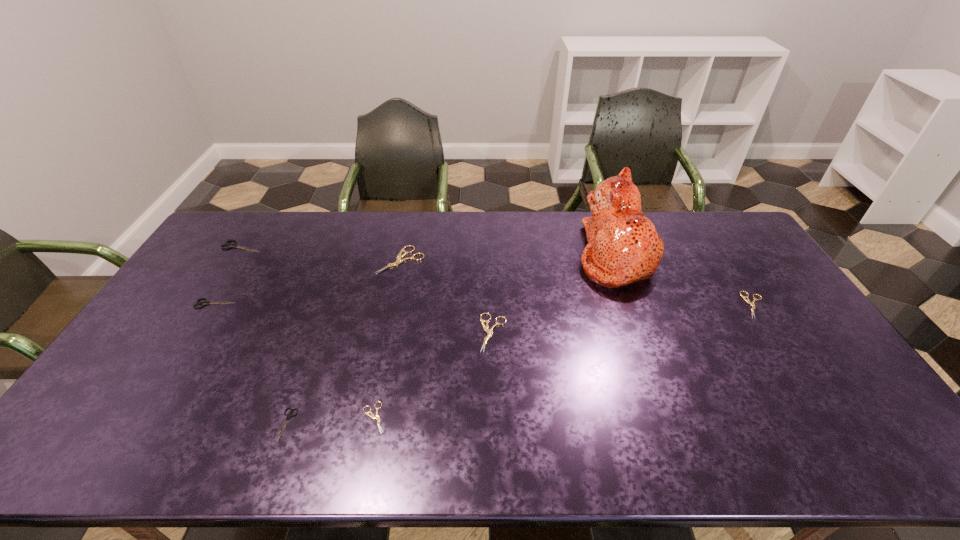
Locate an element on the screen. Image resolution: width=960 pixels, height=540 pixels. vacant area between the rightmost black shears and the second farthest black shears is located at coordinates (252, 364).

Locate an element on the screen. free area in between the second beige shears from right to left and the rightmost object is located at coordinates (624, 319).

Locate which object ranks in proximity to the second biggest black shears. Please provide its 2D coordinates. Your answer should be formatted as a tuple, i.e. [(x, y)], where the tuple contains the x and y coordinates of a point satisfying the conditions above.

[(231, 245)]

Locate which object ranks second in proximity to the rightmost shears. Please provide its 2D coordinates. Your answer should be formatted as a tuple, i.e. [(x, y)], where the tuple contains the x and y coordinates of a point satisfying the conditions above.

[(489, 331)]

Choose which shears is the fourth nearest neighbor to the biggest beige shears. Please provide its 2D coordinates. Your answer should be formatted as a tuple, i.e. [(x, y)], where the tuple contains the x and y coordinates of a point satisfying the conditions above.

[(372, 416)]

Identify which shears is located as the third nearest to the third beige shears from left to right. Please provide its 2D coordinates. Your answer should be formatted as a tuple, i.e. [(x, y)], where the tuple contains the x and y coordinates of a point satisfying the conditions above.

[(288, 416)]

Locate an element on the screen. The height and width of the screenshot is (540, 960). black shears that stands as the third closest to the smallest beige shears is located at coordinates (231, 245).

Point out which black shears is positioned as the nearest to the smallest black shears. Please provide its 2D coordinates. Your answer should be formatted as a tuple, i.e. [(x, y)], where the tuple contains the x and y coordinates of a point satisfying the conditions above.

[(205, 302)]

Locate an element on the screen. The width and height of the screenshot is (960, 540). beige shears identified as the closest to the nearest beige shears is located at coordinates (489, 331).

Identify which beige shears is the second closest to the sixth object from right to left. Please provide its 2D coordinates. Your answer should be formatted as a tuple, i.e. [(x, y)], where the tuple contains the x and y coordinates of a point satisfying the conditions above.

[(489, 331)]